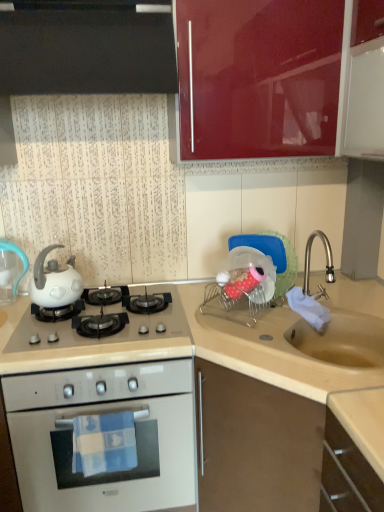
At what (x,y) coordinates should I click in order to perform the action: click on black glossy cabinet at upper left, marked as the 3th cabinetry in a bottom-to-top arrangement. Please return your answer as a coordinate pair (x, y). This screenshot has width=384, height=512. Looking at the image, I should click on (85, 48).

What is the approximate width of beige matte sink at lower right, positioned as the first cabinetry in bottom-to-top order?

It is 37.83 inches.

In order to face white glossy kettle at left, should I rotate leftwards or rightwards?

A 23.090 degree turn to the left will do.

Describe the element at coordinates (104, 443) in the screenshot. The height and width of the screenshot is (512, 384). I see `blue cotton towel at lower center` at that location.

Image resolution: width=384 pixels, height=512 pixels. What do you see at coordinates (55, 281) in the screenshot? I see `white glossy teapot at left` at bounding box center [55, 281].

Find the location of a particular element. Image resolution: width=384 pixels, height=512 pixels. glossy red cabinet at upper center, the second cabinetry viewed from the top is located at coordinates (280, 78).

Find the location of a particular element. The image size is (384, 512). tea pot that appears on the left of blue cotton towel at lower center is located at coordinates (55, 281).

In terms of height, does blue cotton towel at lower center look taller or shorter compared to white glossy teapot at left?

In the image, blue cotton towel at lower center appears to be shorter than white glossy teapot at left.

From a real-world perspective, is blue cotton towel at lower center above or below white glossy teapot at left?

Clearly, from a real-world perspective, blue cotton towel at lower center is below white glossy teapot at left.

Between point (316, 28) and point (88, 54), which one is positioned in front?

Positioned in front is point (88, 54).

Would you say glossy red cabinet at upper center, the second cabinetry ordered from the bottom, is a long distance from black glossy cabinet at upper left, marked as the 3th cabinetry in a bottom-to-top arrangement?

No, glossy red cabinet at upper center, the second cabinetry ordered from the bottom, is in close proximity to black glossy cabinet at upper left, marked as the 3th cabinetry in a bottom-to-top arrangement.

Which of these two, glossy red cabinet at upper center, the second cabinetry viewed from the top, or black glossy cabinet at upper left, marked as the 3th cabinetry in a bottom-to-top arrangement, is smaller?

black glossy cabinet at upper left, marked as the 3th cabinetry in a bottom-to-top arrangement.

Is glossy red cabinet at upper center, the second cabinetry ordered from the bottom, positioned with its back to black glossy cabinet at upper left, positioned as the first cabinetry in top-to-bottom order?

No, black glossy cabinet at upper left, positioned as the first cabinetry in top-to-bottom order, is not at the back of glossy red cabinet at upper center, the second cabinetry ordered from the bottom.

Is the position of beige matte sink at lower right, positioned as the first cabinetry in bottom-to-top order, more distant than that of white glossy kettle at left?

No, it is in front of white glossy kettle at left.

Looking at this image, is beige matte sink at lower right, positioned as the first cabinetry in bottom-to-top order, taller or shorter than white glossy kettle at left?

Considering their sizes, beige matte sink at lower right, positioned as the first cabinetry in bottom-to-top order, has more height than white glossy kettle at left.

Is white glossy kettle at left a part of beige matte sink at lower right, the third cabinetry viewed from the top?

Actually, white glossy kettle at left is outside beige matte sink at lower right, the third cabinetry viewed from the top.

Does beige matte sink at lower right, the third cabinetry viewed from the top, turn towards white glossy kettle at left?

Yes, beige matte sink at lower right, the third cabinetry viewed from the top, is aimed at white glossy kettle at left.

Is white glossy teapot at left thinner than glossy red cabinet at upper center, the second cabinetry viewed from the top?

Correct, the width of white glossy teapot at left is less than that of glossy red cabinet at upper center, the second cabinetry viewed from the top.

From the image's perspective, which cabinetry is the 1st one above the white glossy teapot at left? Please provide its 2D coordinates.

[(280, 78)]

This screenshot has height=512, width=384. I want to click on the 3rd cabinetry in front of the white glossy teapot at left, counting from the anchor's position, so click(x=275, y=450).

Relative to beige matte sink at lower right, the third cabinetry viewed from the top, is white glossy teapot at left in front or behind?

white glossy teapot at left is positioned farther from the viewer than beige matte sink at lower right, the third cabinetry viewed from the top.

From a real-world perspective, is white glossy teapot at left physically located above or below beige matte sink at lower right, the third cabinetry viewed from the top?

white glossy teapot at left is situated higher than beige matte sink at lower right, the third cabinetry viewed from the top, in the real world.

Visually, is white glossy teapot at left positioned to the left or to the right of beige matte sink at lower right, the third cabinetry viewed from the top?

white glossy teapot at left is positioned on beige matte sink at lower right, the third cabinetry viewed from the top,'s left side.

From the picture: Relative to glossy red cabinet at upper center, the second cabinetry viewed from the top, is black glossy cabinet at upper left, marked as the 3th cabinetry in a bottom-to-top arrangement, in front or behind?

black glossy cabinet at upper left, marked as the 3th cabinetry in a bottom-to-top arrangement, is positioned closer to the viewer than glossy red cabinet at upper center, the second cabinetry viewed from the top.

Based on the photo, from the image's perspective, is black glossy cabinet at upper left, marked as the 3th cabinetry in a bottom-to-top arrangement, above or below glossy red cabinet at upper center, the second cabinetry ordered from the bottom?

Based on their image positions, black glossy cabinet at upper left, marked as the 3th cabinetry in a bottom-to-top arrangement, is located above glossy red cabinet at upper center, the second cabinetry ordered from the bottom.

Which object is wider, black glossy cabinet at upper left, positioned as the first cabinetry in top-to-bottom order, or glossy red cabinet at upper center, the second cabinetry ordered from the bottom?

With larger width is black glossy cabinet at upper left, positioned as the first cabinetry in top-to-bottom order.

In terms of size, does black glossy cabinet at upper left, positioned as the first cabinetry in top-to-bottom order, appear bigger or smaller than glossy red cabinet at upper center, the second cabinetry viewed from the top?

Considering their sizes, black glossy cabinet at upper left, positioned as the first cabinetry in top-to-bottom order, takes up less space than glossy red cabinet at upper center, the second cabinetry viewed from the top.

Can you confirm if white glossy teapot at left is wider than black glossy cabinet at upper left, positioned as the first cabinetry in top-to-bottom order?

No.

Which is nearer, (60, 245) or (154, 31)?

Point (60, 245) is positioned farther from the camera compared to point (154, 31).

Which is behind, white glossy teapot at left or black glossy cabinet at upper left, positioned as the first cabinetry in top-to-bottom order?

white glossy teapot at left is further away from the camera.

Considering the relative sizes of white glossy teapot at left and black glossy cabinet at upper left, positioned as the first cabinetry in top-to-bottom order, in the image provided, is white glossy teapot at left bigger than black glossy cabinet at upper left, positioned as the first cabinetry in top-to-bottom order,?

Actually, white glossy teapot at left might be smaller than black glossy cabinet at upper left, positioned as the first cabinetry in top-to-bottom order.

What are the coordinates of `cloth located underneath the white glossy teapot at left (from a real-world perspective)` in the screenshot? It's located at (104, 443).

This screenshot has height=512, width=384. What are the coordinates of `cabinetry behind the black glossy cabinet at upper left, marked as the 3th cabinetry in a bottom-to-top arrangement` in the screenshot? It's located at (280, 78).

Looking at the image, which one is located further to blue cotton towel at lower center, glossy red cabinet at upper center, the second cabinetry ordered from the bottom, or white glossy gas stove at center?

glossy red cabinet at upper center, the second cabinetry ordered from the bottom, lies further to blue cotton towel at lower center than the other object.

Considering their positions, is blue cotton towel at lower center positioned closer to beige matte sink at lower right, the third cabinetry viewed from the top, than white glossy gas stove at center?

The object closer to beige matte sink at lower right, the third cabinetry viewed from the top, is white glossy gas stove at center.

Based on their spatial positions, is white glossy kettle at left or white glossy oven at lower left closer to white glossy teapot at left?

white glossy kettle at left is closer to white glossy teapot at left.

From the image, which object appears to be farther from white glossy oven at lower left, white glossy gas stove at center or white glossy kettle at left?

white glossy kettle at left is positioned further to the anchor white glossy oven at lower left.

When comparing their distances from white glossy teapot at left, does glossy red cabinet at upper center, the second cabinetry viewed from the top, or white glossy oven at lower left seem closer?

Based on the image, white glossy oven at lower left appears to be nearer to white glossy teapot at left.

Estimate the real-world distances between objects in this image. Which object is closer to glossy red cabinet at upper center, the second cabinetry ordered from the bottom, white glossy gas stove at center or blue cotton towel at lower center?

Based on the image, white glossy gas stove at center appears to be nearer to glossy red cabinet at upper center, the second cabinetry ordered from the bottom.

Which object lies further to the anchor point white glossy kettle at left, beige matte sink at lower right, positioned as the first cabinetry in bottom-to-top order, or white glossy oven at lower left?

The object further to white glossy kettle at left is beige matte sink at lower right, positioned as the first cabinetry in bottom-to-top order.

Based on their spatial positions, is white glossy gas stove at center or white glossy teapot at left further from white glossy oven at lower left?

white glossy teapot at left lies further to white glossy oven at lower left than the other object.

The width and height of the screenshot is (384, 512). Find the location of `cloth between white glossy teapot at left and beige matte sink at lower right, positioned as the first cabinetry in bottom-to-top order`. cloth between white glossy teapot at left and beige matte sink at lower right, positioned as the first cabinetry in bottom-to-top order is located at coordinates (104, 443).

At what (x,y) coordinates should I click in order to perform the action: click on cloth between white glossy kettle at left and white glossy oven at lower left from top to bottom. Please return your answer as a coordinate pair (x, y). The width and height of the screenshot is (384, 512). Looking at the image, I should click on (104, 443).

The image size is (384, 512). In order to click on kitchen appliance that lies between black glossy cabinet at upper left, positioned as the first cabinetry in top-to-bottom order, and white glossy teapot at left from top to bottom in this screenshot , I will do `click(11, 270)`.

Where is `gas stove between black glossy cabinet at upper left, positioned as the first cabinetry in top-to-bottom order, and beige matte sink at lower right, positioned as the first cabinetry in bottom-to-top order, in the up-down direction`? Image resolution: width=384 pixels, height=512 pixels. gas stove between black glossy cabinet at upper left, positioned as the first cabinetry in top-to-bottom order, and beige matte sink at lower right, positioned as the first cabinetry in bottom-to-top order, in the up-down direction is located at coordinates (101, 336).